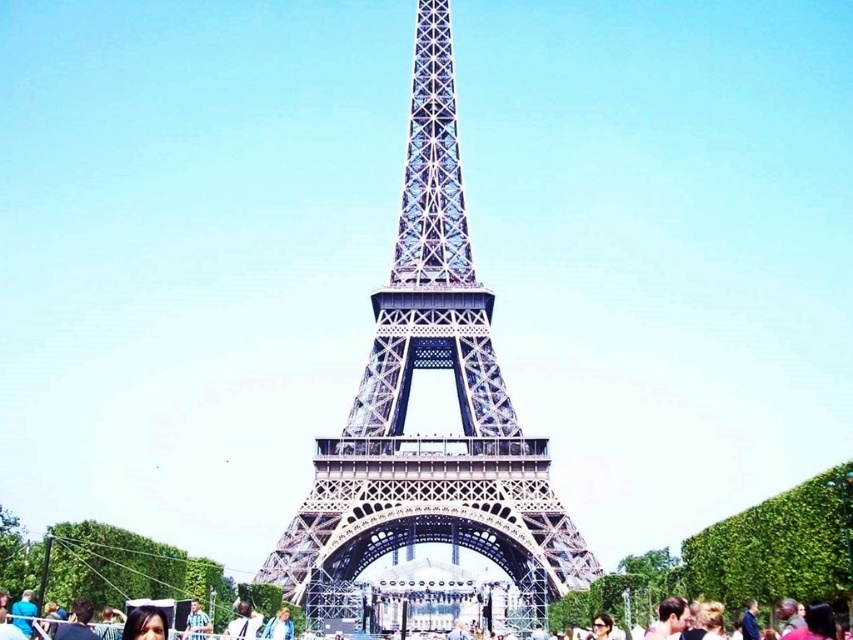
Question: Is metallic blue tower at center in front of matte black crowd at lower center?

Choices:
 (A) yes
 (B) no

Answer: (B)

Question: Does metallic blue tower at center have a greater width compared to matte black crowd at lower center?

Choices:
 (A) no
 (B) yes

Answer: (A)

Question: Is metallic blue tower at center thinner than matte black crowd at lower center?

Choices:
 (A) no
 (B) yes

Answer: (B)

Question: Which of the following is the closest to the observer?

Choices:
 (A) matte black crowd at lower center
 (B) metallic blue tower at center

Answer: (A)